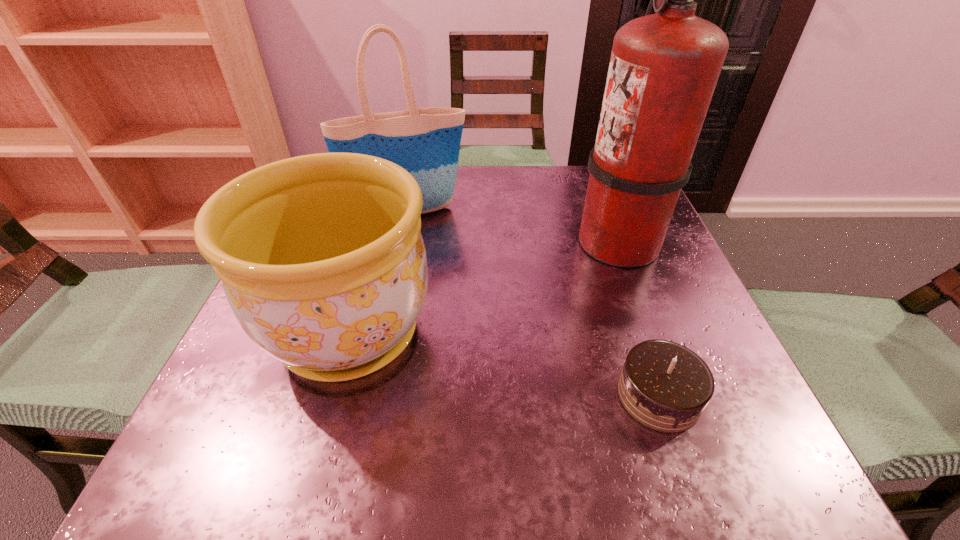
The width and height of the screenshot is (960, 540). I want to click on fire extinguisher located at the far edge, so click(x=664, y=66).

Where is `tote bag at the far edge`? The width and height of the screenshot is (960, 540). tote bag at the far edge is located at coordinates (425, 142).

Find the location of a particular element. Image resolution: width=960 pixels, height=540 pixels. object positioned at the near edge is located at coordinates pos(665,386).

Identify the location of tote bag that is at the left edge. This screenshot has height=540, width=960. (425, 142).

Identify the location of flowerpot at the left edge. This screenshot has width=960, height=540. pyautogui.click(x=322, y=260).

You are a GUI agent. You are given a task and a screenshot of the screen. Output one action in this format:
    pyautogui.click(x=<x>, y=<y>)
    Task: Click on the fire extinguisher at the right edge
    
    Given the screenshot: What is the action you would take?
    pyautogui.click(x=664, y=66)

The height and width of the screenshot is (540, 960). I want to click on chocolate cake at the right edge, so click(x=665, y=386).

This screenshot has height=540, width=960. I want to click on object located at the far left corner, so click(x=425, y=142).

What are the coordinates of `object located at the far right corner` in the screenshot? It's located at (664, 66).

The image size is (960, 540). I want to click on object that is at the near right corner, so click(x=665, y=386).